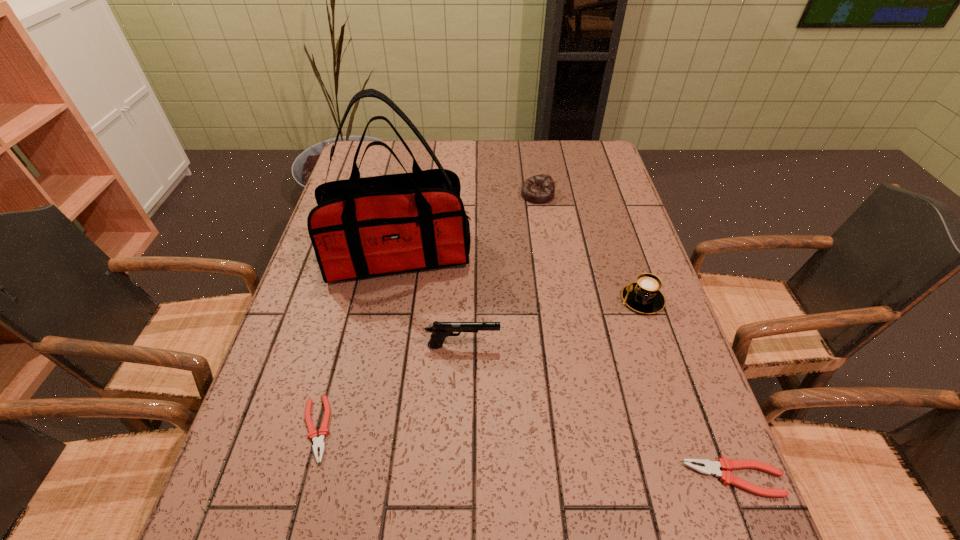
Identify the location of object present at the near left corner. (318, 442).

You are a GUI agent. You are given a task and a screenshot of the screen. Output one action in this format:
    pyautogui.click(x=<x>, y=<y>)
    Task: Click on the object at the near right corner
    
    Given the screenshot: What is the action you would take?
    pyautogui.click(x=710, y=467)

In the image, there is a desktop. Identify the location of free space at the far edge. Image resolution: width=960 pixels, height=540 pixels. (404, 160).

In the image, there is a desktop. At what (x,y) coordinates should I click in order to perform the action: click on vacant region at the near edge. Please return your answer as a coordinate pair (x, y). This screenshot has width=960, height=540. Looking at the image, I should click on (466, 456).

At what (x,y) coordinates should I click in order to perform the action: click on free space at the right edge of the desktop. Please return your answer as a coordinate pair (x, y). Looking at the image, I should click on [698, 399].

Where is `free point at the far left corner`? The width and height of the screenshot is (960, 540). free point at the far left corner is located at coordinates (374, 147).

You are a GUI agent. You are given a task and a screenshot of the screen. Output one action in this format:
    pyautogui.click(x=<x>, y=<y>)
    Task: Click on the vacant space at the near left corner
    
    Given the screenshot: What is the action you would take?
    pyautogui.click(x=253, y=462)

This screenshot has height=540, width=960. I want to click on free space between the shortest object and the duffel bag, so click(357, 342).

I want to click on unoccupied area between the gun and the taller pliers, so click(599, 412).

Identify the location of vacant area between the fourth farthest object and the third shortest object. The image size is (960, 540). (500, 270).